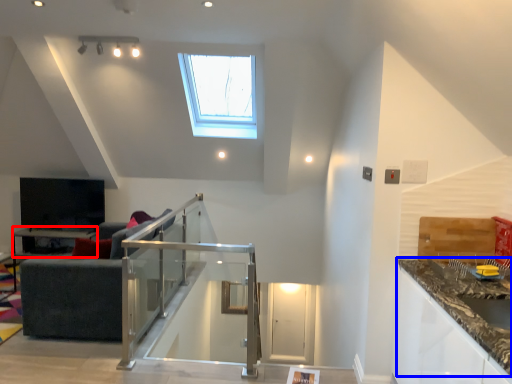
Question: Among these objects, which one is farthest to the camera, table (highlighted by a red box) or countertop (highlighted by a blue box)?

Choices:
 (A) table
 (B) countertop

Answer: (A)